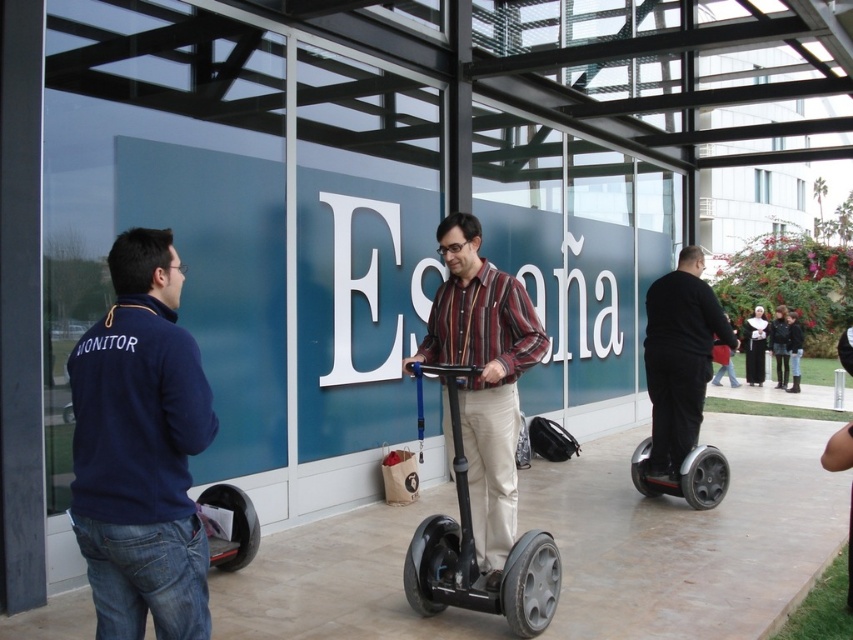
You are standing at the point marked as point (753,346) in the image. What object is located exactly at this point?

The dark brown nun habit is located exactly at point (753,346).

You are a pedestrian standing on the pathway in the scene. You want to reach the dark brown leather jacket at center without crossing the black rubber scooter at right. Is it possible to walk around the scooter to your left side?

The black rubber scooter at right is to the left of the dark brown leather jacket at center, so you can walk around the scooter to your left side to reach the jacket without crossing it.